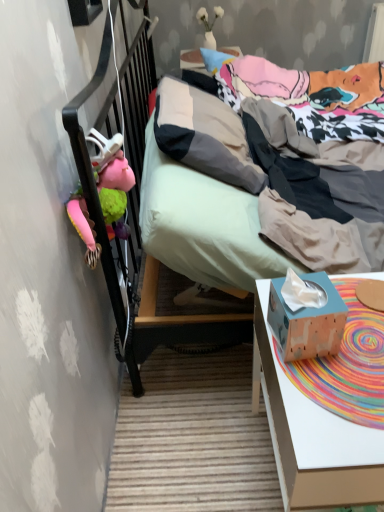
Find the location of `wooden tissue box at right`. wooden tissue box at right is located at coordinates (312, 435).

What do you see at coordinates (112, 181) in the screenshot? This screenshot has width=384, height=512. I see `pink fabric stuffed animal at left, which ranks as the first toy in left-to-right order` at bounding box center [112, 181].

The width and height of the screenshot is (384, 512). What do you see at coordinates (101, 216) in the screenshot?
I see `textured cotton bed at center` at bounding box center [101, 216].

At what (x,y) coordinates should I click in order to perform the action: click on wooden tissue box at right. Please return your answer as a coordinate pair (x, y). Looking at the image, I should click on (312, 435).

Considering the relative positions of wooden tissue box at lower right and pink fabric stuffed animal at left, which ranks as the first toy in left-to-right order, in the image provided, is wooden tissue box at lower right to the left or to the right of pink fabric stuffed animal at left, which ranks as the first toy in left-to-right order,?

wooden tissue box at lower right is to the right of pink fabric stuffed animal at left, which ranks as the first toy in left-to-right order.

Considering the sizes of wooden tissue box at lower right and pink fabric stuffed animal at left, the second toy when ordered from back to front, in the image, is wooden tissue box at lower right bigger or smaller than pink fabric stuffed animal at left, the second toy when ordered from back to front,?

In the image, wooden tissue box at lower right appears to be smaller than pink fabric stuffed animal at left, the second toy when ordered from back to front.

Can we say wooden tissue box at lower right lies outside pink fabric stuffed animal at left, which is counted as the second toy, starting from the right?

wooden tissue box at lower right lies outside pink fabric stuffed animal at left, which is counted as the second toy, starting from the right,'s area.

Which object is further away from the camera, wooden tissue box at lower right or pink fabric stuffed animal at left, which ranks as the first toy in left-to-right order?

pink fabric stuffed animal at left, which ranks as the first toy in left-to-right order, is further from the camera.

Is textured cotton bed at center turned away from wooden tissue box at lower right?

No, textured cotton bed at center's orientation is not away from wooden tissue box at lower right.

From a real-world perspective, which object stands above the other?

In real-world perspective, wooden tissue box at lower right is above.

Considering the sizes of objects textured cotton bed at center and wooden tissue box at lower right in the image provided, who is taller, textured cotton bed at center or wooden tissue box at lower right?

textured cotton bed at center.

Choose the correct answer: Is textured cotton bed at center inside wooden tissue box at lower right or outside it?

textured cotton bed at center lies outside wooden tissue box at lower right.

Considering the relative sizes of pink fabric stuffed animal at left, the second toy when ordered from back to front, and wooden tissue box at lower right in the image provided, is pink fabric stuffed animal at left, the second toy when ordered from back to front, smaller than wooden tissue box at lower right?

Incorrect, pink fabric stuffed animal at left, the second toy when ordered from back to front, is not smaller in size than wooden tissue box at lower right.

Which is correct: pink fabric stuffed animal at left, which is counted as the second toy, starting from the right, is inside wooden tissue box at lower right, or outside of it?

pink fabric stuffed animal at left, which is counted as the second toy, starting from the right, is spatially situated outside wooden tissue box at lower right.

What's the angular difference between pink fabric stuffed animal at left, the second toy when ordered from back to front, and wooden tissue box at lower right's facing directions?

They differ by 12.6 degrees in their facing directions.

Measure the distance from textured cotton bed at center to white matte vase at upper center, which appears as the first toy when viewed from the right.

A distance of 1.50 meters exists between textured cotton bed at center and white matte vase at upper center, which appears as the first toy when viewed from the right.

Is textured cotton bed at center shorter than white matte vase at upper center, the second toy viewed from the front?

In fact, textured cotton bed at center may be taller than white matte vase at upper center, the second toy viewed from the front.

Are textured cotton bed at center and white matte vase at upper center, arranged as the first toy when viewed from the back, making contact?

No, textured cotton bed at center is not making contact with white matte vase at upper center, arranged as the first toy when viewed from the back.

Which is in front, textured cotton bed at center or white matte vase at upper center, which ranks as the 2th toy in bottom-to-top order?

textured cotton bed at center is more forward.

Are white matte vase at upper center, which ranks as the second toy in left-to-right order, and wooden tissue box at lower right making contact?

No, white matte vase at upper center, which ranks as the second toy in left-to-right order, is not next to wooden tissue box at lower right.

What's the angular difference between white matte vase at upper center, which ranks as the 2th toy in bottom-to-top order, and wooden tissue box at lower right's facing directions?

6.33 degrees separate the facing orientations of white matte vase at upper center, which ranks as the 2th toy in bottom-to-top order, and wooden tissue box at lower right.

Does white matte vase at upper center, the second toy viewed from the front, turn towards wooden tissue box at lower right?

No, white matte vase at upper center, the second toy viewed from the front, is not oriented towards wooden tissue box at lower right.

Which of these two, white matte vase at upper center, which ranks as the second toy in left-to-right order, or wooden tissue box at lower right, stands shorter?

With less height is wooden tissue box at lower right.

Is wooden tissue box at right next to textured cotton bed at center?

wooden tissue box at right and textured cotton bed at center are clearly separated.

Is wooden tissue box at right closer to camera compared to textured cotton bed at center?

No, it is behind textured cotton bed at center.

Find the location of a particular element. Image resolution: width=384 pixels, height=512 pixels. desk behind the textured cotton bed at center is located at coordinates (312, 435).

From the image's perspective, is wooden tissue box at right below textured cotton bed at center?

Yes, from the image's perspective, wooden tissue box at right is beneath textured cotton bed at center.

At what (x,y) coordinates should I click in order to perform the action: click on the 2nd toy to the left of the textured cotton bed at center, counting from the anchor's position. Please return your answer as a coordinate pair (x, y). The height and width of the screenshot is (512, 384). Looking at the image, I should click on (112, 181).

Can we say textured cotton bed at center lies outside pink fabric stuffed animal at left, the second toy when ordered from back to front?

Yes.

From the picture: Does textured cotton bed at center turn towards pink fabric stuffed animal at left, which is counted as the second toy, starting from the right?

No, textured cotton bed at center is not turned towards pink fabric stuffed animal at left, which is counted as the second toy, starting from the right.

Considering the relative sizes of textured cotton bed at center and pink fabric stuffed animal at left, placed as the 1th toy when sorted from front to back, in the image provided, is textured cotton bed at center taller than pink fabric stuffed animal at left, placed as the 1th toy when sorted from front to back,?

Indeed, textured cotton bed at center has a greater height compared to pink fabric stuffed animal at left, placed as the 1th toy when sorted from front to back.

You are a GUI agent. You are given a task and a screenshot of the screen. Output one action in this format:
    pyautogui.click(x=<x>, y=<y>)
    Task: Click on the 1st toy above when counting from the wooden tissue box at lower right (from the image's perspective)
    
    Given the screenshot: What is the action you would take?
    pyautogui.click(x=112, y=181)

Locate an element on the screen. The height and width of the screenshot is (512, 384). bed below the wooden tissue box at lower right (from a real-world perspective) is located at coordinates (101, 216).

Based on their spatial positions, is wooden tissue box at lower right or pink fabric stuffed animal at left, marked as the second toy in a top-to-bottom arrangement, closer to white matte vase at upper center, which is the 1th toy in top-to-bottom order?

Based on the image, pink fabric stuffed animal at left, marked as the second toy in a top-to-bottom arrangement, appears to be nearer to white matte vase at upper center, which is the 1th toy in top-to-bottom order.

Based on their spatial positions, is white matte vase at upper center, which appears as the first toy when viewed from the right, or wooden tissue box at lower right closer to textured cotton bed at center?

wooden tissue box at lower right.

Considering their positions, is wooden tissue box at right positioned closer to pink fabric stuffed animal at left, which ranks as the first toy in left-to-right order, than white matte vase at upper center, which ranks as the second toy in left-to-right order?

The object closer to pink fabric stuffed animal at left, which ranks as the first toy in left-to-right order, is wooden tissue box at right.

From the image, which object appears to be farther from white matte vase at upper center, the second toy viewed from the front, wooden tissue box at right or textured cotton bed at center?

wooden tissue box at right lies further to white matte vase at upper center, the second toy viewed from the front, than the other object.

Estimate the real-world distances between objects in this image. Which object is closer to wooden tissue box at right, pink fabric stuffed animal at left, marked as the second toy in a top-to-bottom arrangement, or textured cotton bed at center?

pink fabric stuffed animal at left, marked as the second toy in a top-to-bottom arrangement, lies closer to wooden tissue box at right than the other object.

Which object lies nearer to the anchor point wooden tissue box at lower right, wooden tissue box at right or textured cotton bed at center?

The object closer to wooden tissue box at lower right is wooden tissue box at right.

Looking at the image, which one is located further to wooden tissue box at right, textured cotton bed at center or pink fabric stuffed animal at left, marked as the second toy in a top-to-bottom arrangement?

Among the two, textured cotton bed at center is located further to wooden tissue box at right.

When comparing their distances from wooden tissue box at right, does pink fabric stuffed animal at left, placed as the 1th toy when sorted from front to back, or white matte vase at upper center, which appears as the first toy when viewed from the right, seem closer?

pink fabric stuffed animal at left, placed as the 1th toy when sorted from front to back, is positioned closer to the anchor wooden tissue box at right.

The width and height of the screenshot is (384, 512). What are the coordinates of `toy between textured cotton bed at center and white matte vase at upper center, which is the 1th toy in top-to-bottom order, in the front-back direction` in the screenshot? It's located at 112,181.

Where is `box positioned between wooden tissue box at right and white matte vase at upper center, which is the 1th toy in top-to-bottom order, from near to far`? The width and height of the screenshot is (384, 512). box positioned between wooden tissue box at right and white matte vase at upper center, which is the 1th toy in top-to-bottom order, from near to far is located at coordinates (307, 321).

At what (x,y) coordinates should I click in order to perform the action: click on box located between textured cotton bed at center and white matte vase at upper center, which ranks as the 2th toy in bottom-to-top order, in the depth direction. Please return your answer as a coordinate pair (x, y). Image resolution: width=384 pixels, height=512 pixels. Looking at the image, I should click on (307, 321).

Where is `desk between textured cotton bed at center and white matte vase at upper center, arranged as the first toy when viewed from the back, in the front-back direction`? desk between textured cotton bed at center and white matte vase at upper center, arranged as the first toy when viewed from the back, in the front-back direction is located at coordinates (312, 435).